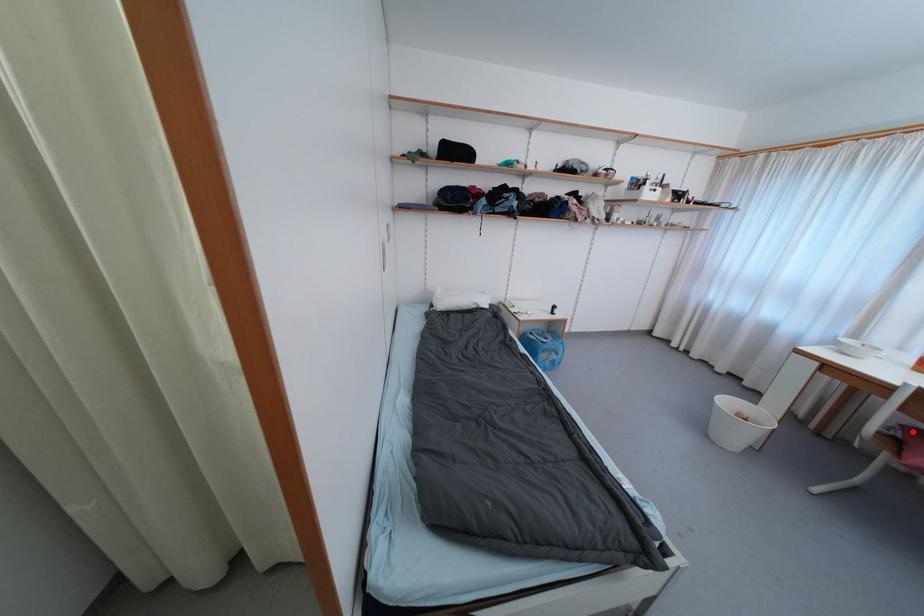
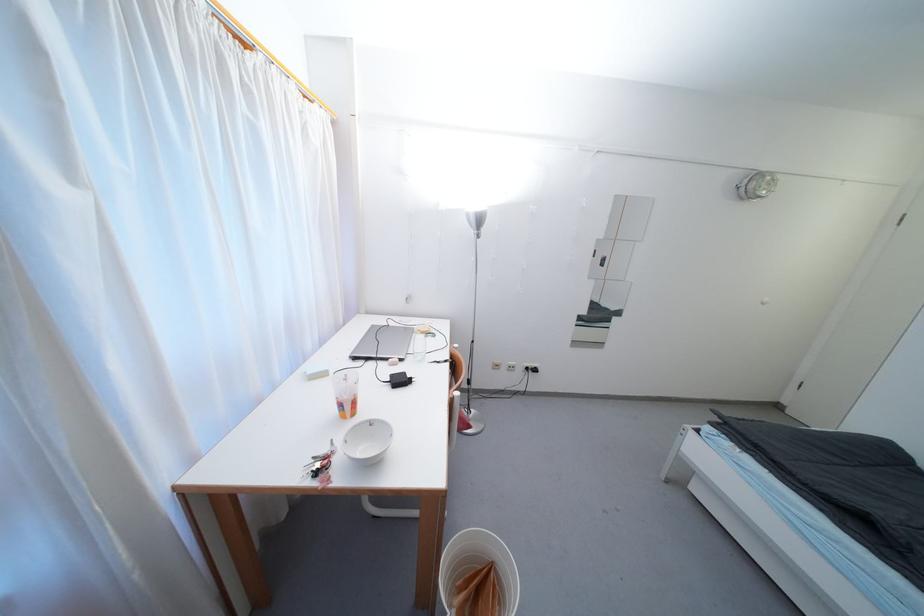
Question: I am providing you with two images of the same scene from different viewpoints. A red point is marked on the first image. At the location where the point appears in image 1, is it still visible in image 2?

Choices:
 (A) Yes
 (B) No

Answer: (B)